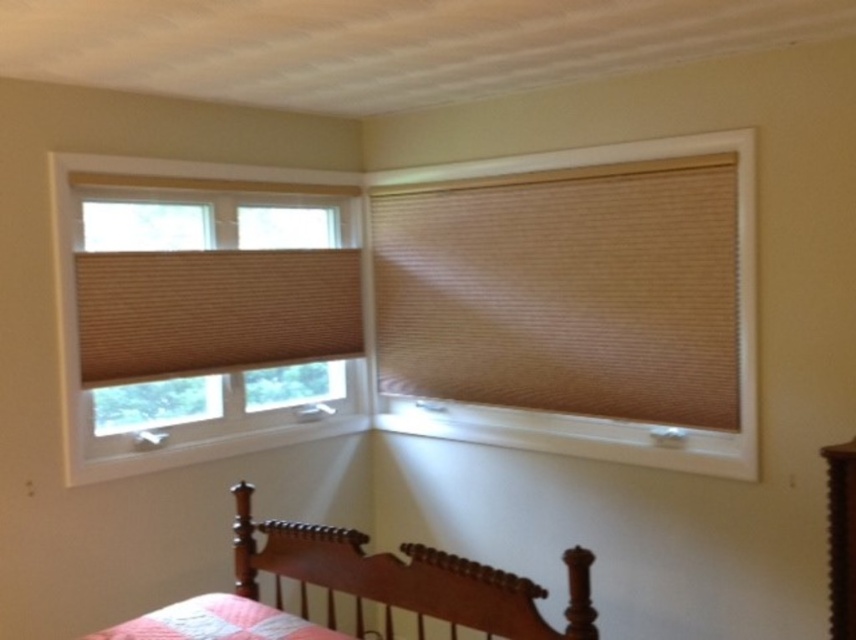
From the picture: Who is higher up, tan woven blinds at left or wooden bed at lower center?

tan woven blinds at left is above.

Is tan woven blinds at left wider than wooden bed at lower center?

In fact, tan woven blinds at left might be narrower than wooden bed at lower center.

Identify the location of tan woven blinds at left. The image size is (856, 640). (203, 314).

Locate an element on the screen. Image resolution: width=856 pixels, height=640 pixels. beige textured blind at upper right is located at coordinates (565, 291).

From the picture: Measure the distance between beige textured blind at upper right and camera.

8.32 feet

Identify the location of beige textured blind at upper right. This screenshot has height=640, width=856. (565, 291).

From the picture: Does tan woven blind at left have a larger size compared to wooden bed at lower center?

No.

Does tan woven blind at left come in front of wooden bed at lower center?

No, tan woven blind at left is behind wooden bed at lower center.

Does point (358, 266) come closer to viewer compared to point (506, 632)?

That is False.

The width and height of the screenshot is (856, 640). In order to click on tan woven blind at left in this screenshot , I will do `click(214, 310)`.